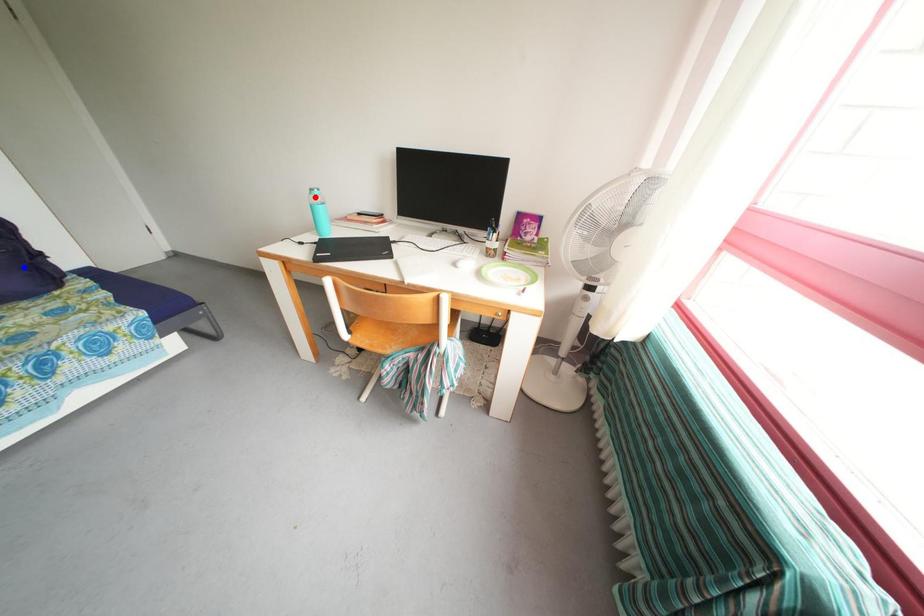
Question: Which of the two points in the image is closer to the camera?

Choices:
 (A) Blue point is closer.
 (B) Red point is closer.

Answer: (A)